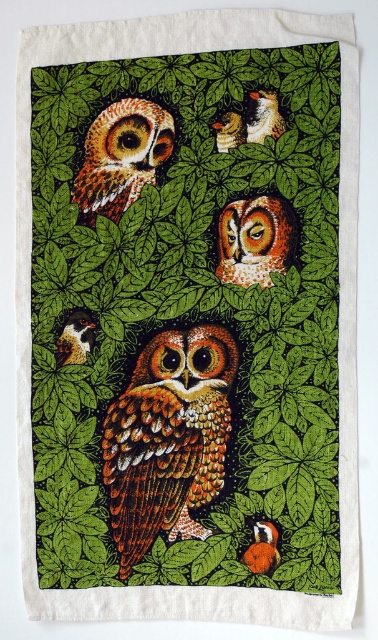
Who is taller, speckled white owl at upper center or orange felt bird at center?

Standing taller between the two is speckled white owl at upper center.

Where is `speckled white owl at upper center`? This screenshot has width=378, height=640. speckled white owl at upper center is located at coordinates (74, 339).

Which is in front, point (79, 336) or point (247, 561)?

Point (247, 561) is more forward.

I want to click on speckled white owl at upper center, so click(x=74, y=339).

Does speckled brown owl at center appear under orange felt bird at center?

No.

Is speckled brown owl at center behind orange felt bird at center?

No, speckled brown owl at center is closer to the viewer.

Does point (289, 236) come behind point (269, 548)?

No, (289, 236) is in front of (269, 548).

This screenshot has height=640, width=378. Find the location of `speckled brown owl at center`. speckled brown owl at center is located at coordinates (255, 241).

Is the position of shiny brown owl at center more distant than that of brown speckled owl at upper center?

No, shiny brown owl at center is in front of brown speckled owl at upper center.

Between shiny brown owl at center and brown speckled owl at upper center, which one appears on the right side from the viewer's perspective?

brown speckled owl at upper center

At what (x,y) coordinates should I click in order to perform the action: click on shiny brown owl at center. Please return your answer as a coordinate pair (x, y). Looking at the image, I should click on (167, 438).

Find the location of a particular element. This screenshot has width=378, height=640. shiny brown owl at center is located at coordinates (167, 438).